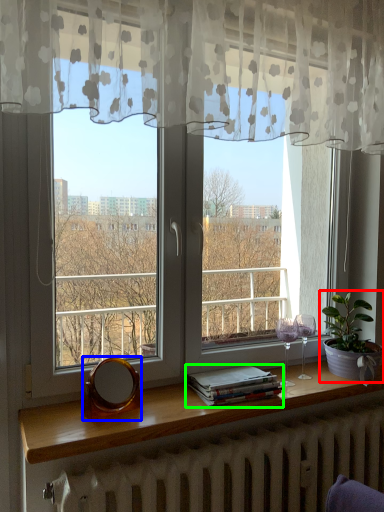
Question: Based on their relative distances, which object is farther from houseplant (highlighted by a red box)? Choose from mirror (highlighted by a blue box) and book (highlighted by a green box).

Choices:
 (A) mirror
 (B) book

Answer: (A)